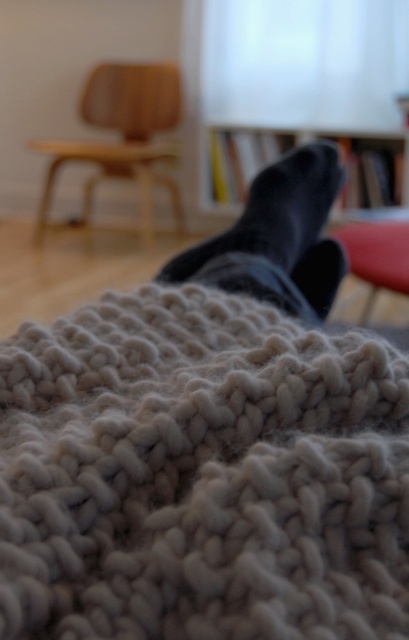
Who is shorter, black soft sock at center or smooth red chair at center?

Standing shorter between the two is black soft sock at center.

Is black soft sock at center smaller than smooth red chair at center?

Yes, black soft sock at center is smaller than smooth red chair at center.

Is point (328, 285) positioned behind point (379, 262)?

No, (328, 285) is closer to viewer.

Image resolution: width=409 pixels, height=640 pixels. I want to click on black soft sock at center, so click(276, 237).

Which is above, fuzzy woolen blanket at lower center or wooden bookshelf at center?

wooden bookshelf at center

Is fuzzy woolen blanket at lower center wider than wooden bookshelf at center?

Incorrect, fuzzy woolen blanket at lower center's width does not surpass wooden bookshelf at center's.

Is point (20, 381) positioned before point (395, 218)?

Yes.

Locate an element on the screen. The width and height of the screenshot is (409, 640). fuzzy woolen blanket at lower center is located at coordinates (200, 474).

Which is more to the left, fuzzy woolen blanket at lower center or smooth red chair at center?

fuzzy woolen blanket at lower center is more to the left.

Is point (240, 547) positioned before point (357, 269)?

Yes, it is.

What do you see at coordinates (200, 474) in the screenshot? Image resolution: width=409 pixels, height=640 pixels. I see `fuzzy woolen blanket at lower center` at bounding box center [200, 474].

This screenshot has height=640, width=409. I want to click on fuzzy woolen blanket at lower center, so [200, 474].